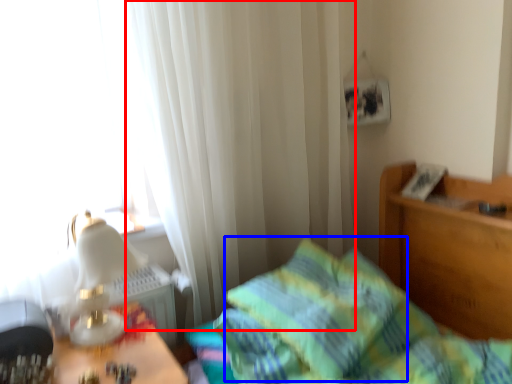
Question: Which object is closer to the camera taking this photo, curtain (highlighted by a red box) or pillow (highlighted by a blue box)?

Choices:
 (A) curtain
 (B) pillow

Answer: (B)